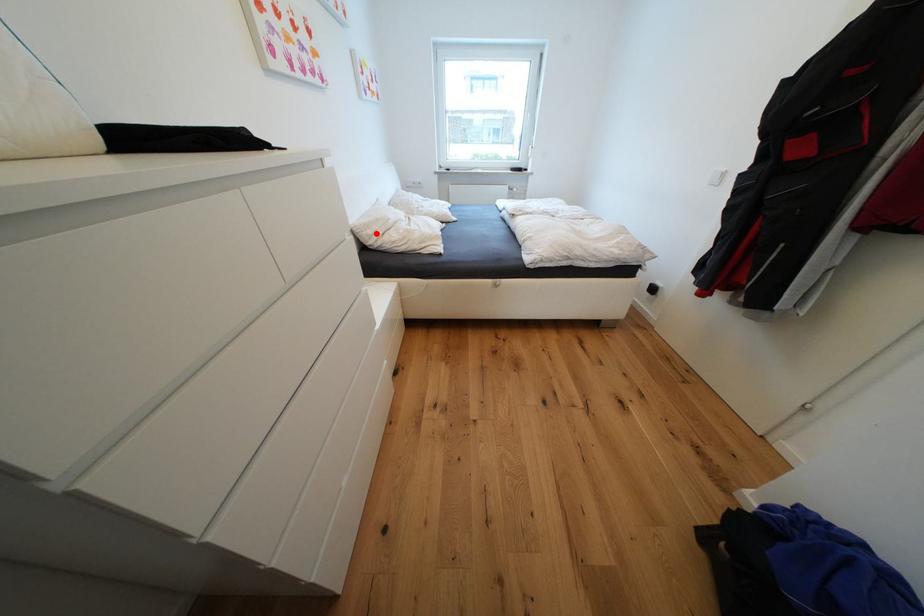
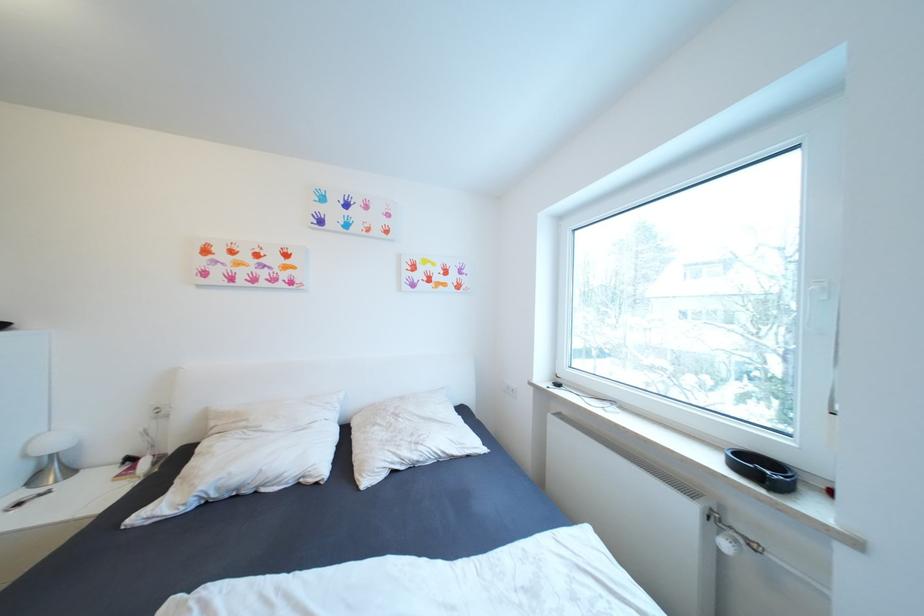
The point at the highlighted location is marked in the first image. Where is the corresponding point in the second image?

(220, 424)